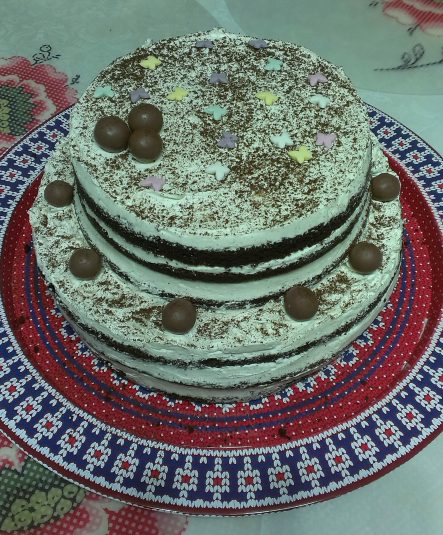
Where is `table`? The height and width of the screenshot is (535, 443). table is located at coordinates (295, 521).